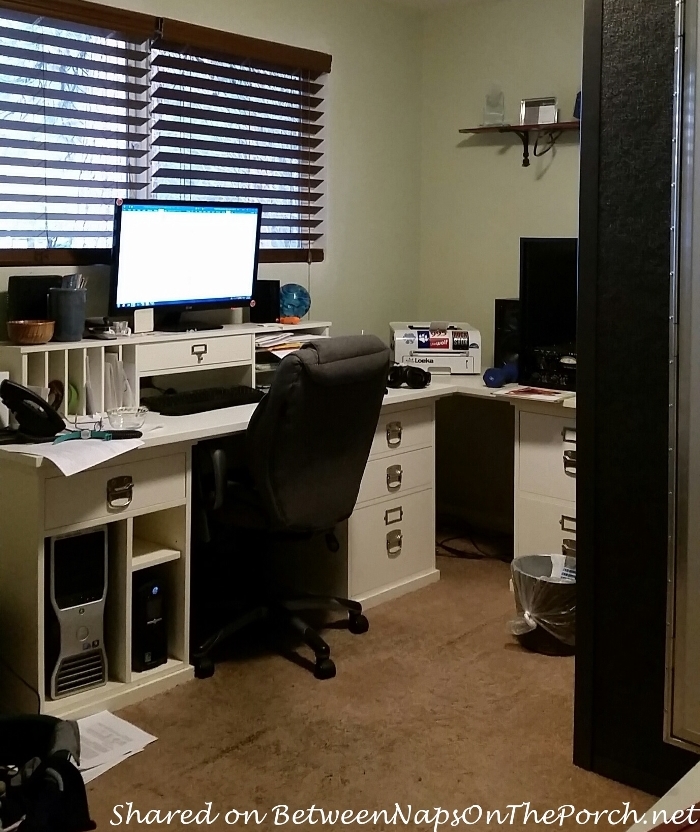
Locate an element on the screen. computer is located at coordinates (88, 621).